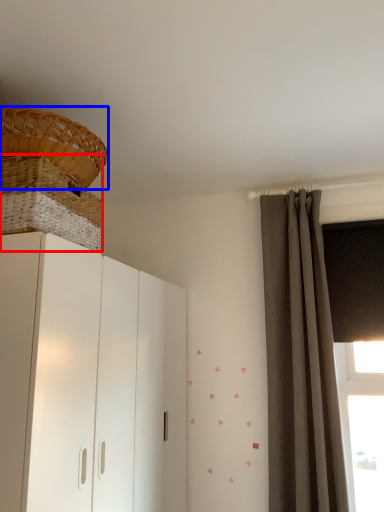
Question: Which object appears closest to the camera in this image, basket (highlighted by a red box) or basket (highlighted by a blue box)?

Choices:
 (A) basket
 (B) basket

Answer: (A)